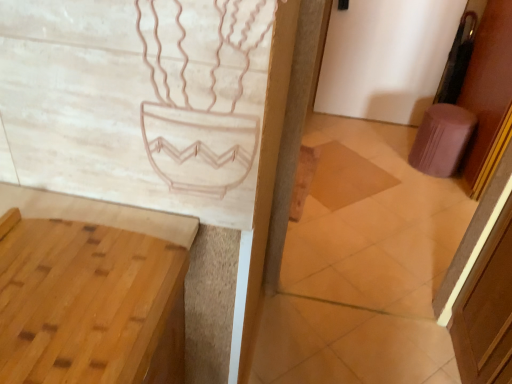
Question: In terms of size, does light brown wood vanity at lower left appear bigger or smaller than brown wooden tile at center?

Choices:
 (A) small
 (B) big

Answer: (B)

Question: Based on their positions, is light brown wood vanity at lower left located to the left or right of brown wooden tile at center?

Choices:
 (A) right
 (B) left

Answer: (B)

Question: Which of these objects is positioned farthest from the brown wood screen door at right?

Choices:
 (A) brown wooden tile at center
 (B) light brown wood vanity at lower left
 (C) purple fabric door at right
 (D) pink fabric stool at right

Answer: (D)

Question: Which of these objects is positioned closest to the light brown wood vanity at lower left?

Choices:
 (A) pink fabric stool at right
 (B) brown wooden tile at center
 (C) brown wood screen door at right
 (D) purple fabric door at right

Answer: (C)